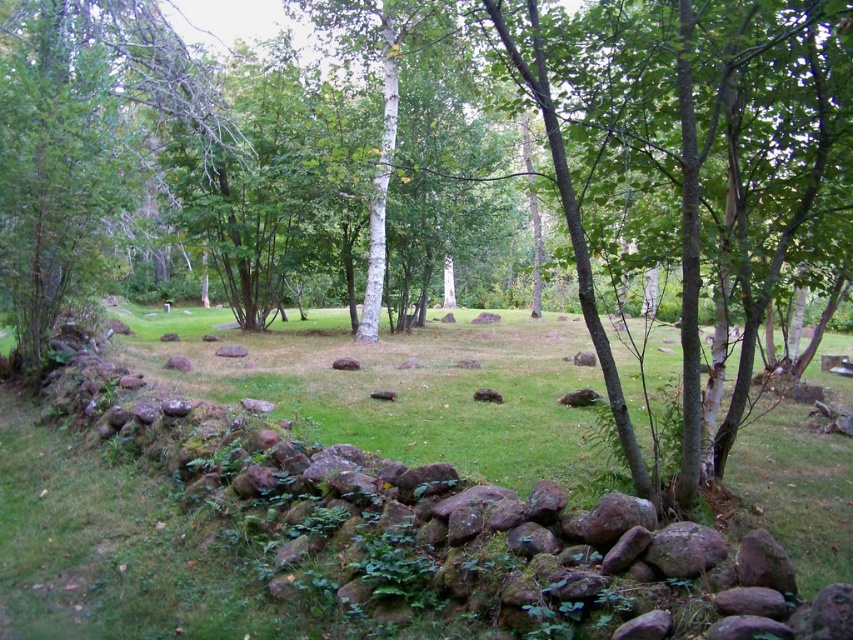
Question: Is rocky wall at lower left below green leafy tree at center?

Choices:
 (A) yes
 (B) no

Answer: (A)

Question: Which point is closer to the camera taking this photo?

Choices:
 (A) (549, 396)
 (B) (693, 150)
 (C) (158, 92)

Answer: (B)

Question: Does rocky wall at lower left have a smaller size compared to green leafy tree at center?

Choices:
 (A) no
 (B) yes

Answer: (A)

Question: Among these points, which one is farthest from the camera?

Choices:
 (A) (103, 632)
 (B) (569, 204)

Answer: (B)

Question: Which of the following is the closest to the observer?

Choices:
 (A) (18, 593)
 (B) (36, 99)
 (C) (694, 397)

Answer: (C)

Question: Can you confirm if green leafy tree at center is wider than smooth bark tree at center?

Choices:
 (A) no
 (B) yes

Answer: (A)